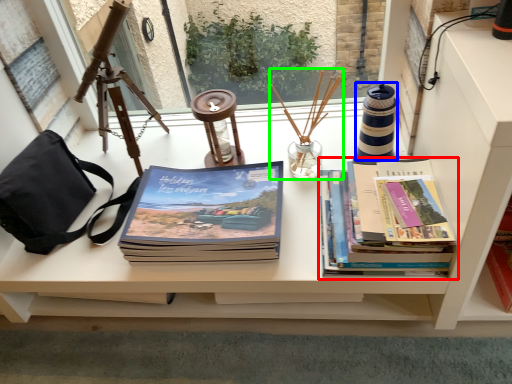
Question: Which object is positioned closest to book (highlighted by a red box)? Select from candle holder (highlighted by a blue box) and candle holder (highlighted by a green box).

Choices:
 (A) candle holder
 (B) candle holder

Answer: (A)